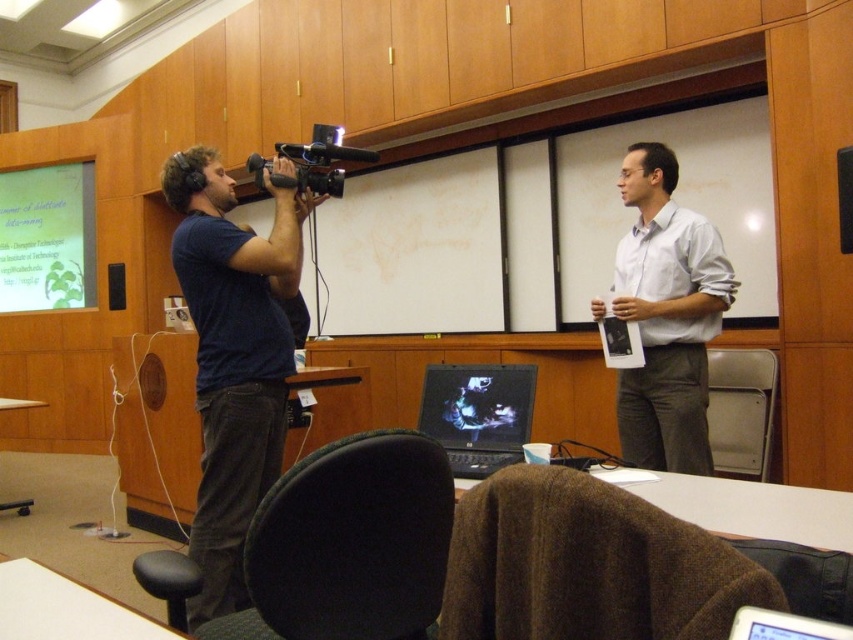
You are a student trying to take a photo of the white matte shirt at center and the green matte projection screen at upper left for your notes. Which object should you focus on first if you want to capture both in the same frame without moving your camera?

The white matte shirt at center is located below the green matte projection screen at upper left, so you should focus on the green matte projection screen at upper left first as it is higher up and ensure it stays in frame while adjusting the camera angle to include the white matte shirt at center below it.

You are setting up equipment in a classroom. You have a green matte projection screen at upper left and a black glossy laptop at center. Which object is positioned higher in the scene?

The green matte projection screen at upper left is positioned higher than the black glossy laptop at center.